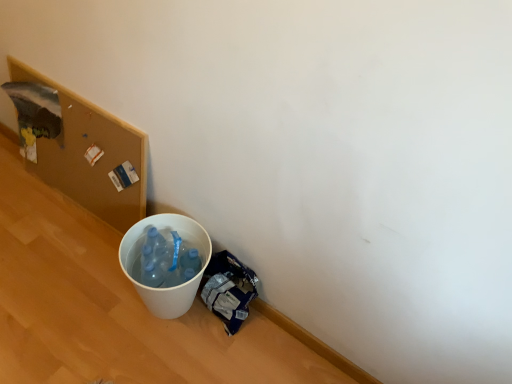
Question: Can you confirm if white plastic bucket at lower left is wider than blue plastic bag at lower right?

Choices:
 (A) no
 (B) yes

Answer: (B)

Question: From a real-world perspective, is white plastic bucket at lower left on top of blue plastic bag at lower right?

Choices:
 (A) yes
 (B) no

Answer: (A)

Question: Does white plastic bucket at lower left have a greater height compared to blue plastic bag at lower right?

Choices:
 (A) yes
 (B) no

Answer: (A)

Question: Does white plastic bucket at lower left have a lesser width compared to blue plastic bag at lower right?

Choices:
 (A) yes
 (B) no

Answer: (B)

Question: Can you confirm if white plastic bucket at lower left is positioned to the left of blue plastic bag at lower right?

Choices:
 (A) yes
 (B) no

Answer: (A)

Question: From a real-world perspective, is white plastic bucket at lower left physically below blue plastic bag at lower right?

Choices:
 (A) yes
 (B) no

Answer: (B)

Question: Is blue plastic bag at lower right looking in the opposite direction of wooden corkboard at upper left?

Choices:
 (A) no
 (B) yes

Answer: (A)

Question: Are blue plastic bag at lower right and wooden corkboard at upper left located far from each other?

Choices:
 (A) no
 (B) yes

Answer: (A)

Question: From a real-world perspective, is blue plastic bag at lower right located beneath wooden corkboard at upper left?

Choices:
 (A) no
 (B) yes

Answer: (B)

Question: Is blue plastic bag at lower right not inside wooden corkboard at upper left?

Choices:
 (A) no
 (B) yes

Answer: (B)

Question: Does blue plastic bag at lower right have a greater height compared to wooden corkboard at upper left?

Choices:
 (A) yes
 (B) no

Answer: (B)

Question: From the image's perspective, does blue plastic bag at lower right appear higher than wooden corkboard at upper left?

Choices:
 (A) no
 (B) yes

Answer: (A)

Question: Does blue plastic bag at lower right have a lesser height compared to white plastic bucket at lower left?

Choices:
 (A) yes
 (B) no

Answer: (A)